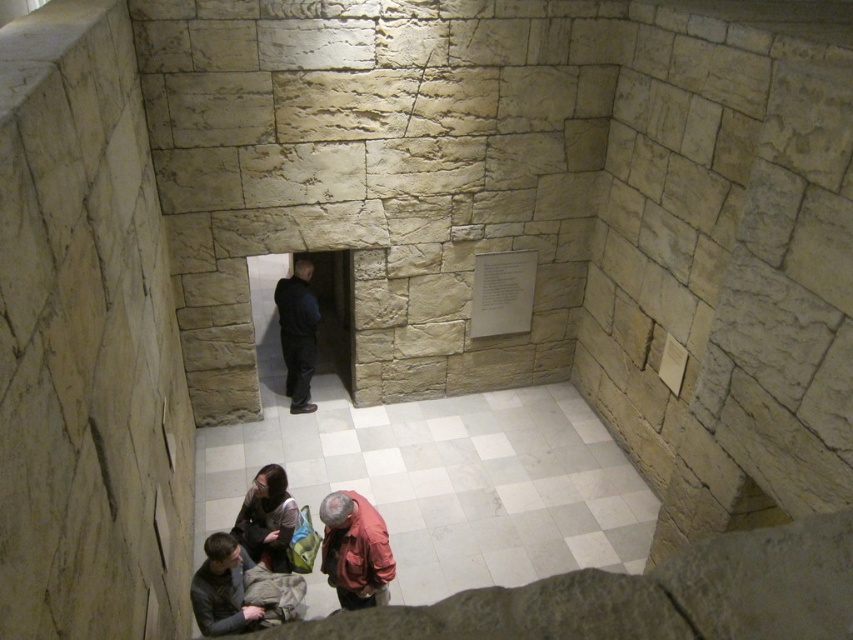
You are a customer in this space and want to hang a small picture frame between the dark gray sweater at lower left and the matte black jacket at lower center. Based on their heights, which object should the frame be placed closer to?

The dark gray sweater at lower left has a lesser height compared to the matte black jacket at lower center, so the frame should be placed closer to the dark gray sweater at lower left to ensure it is centered between the two objects.